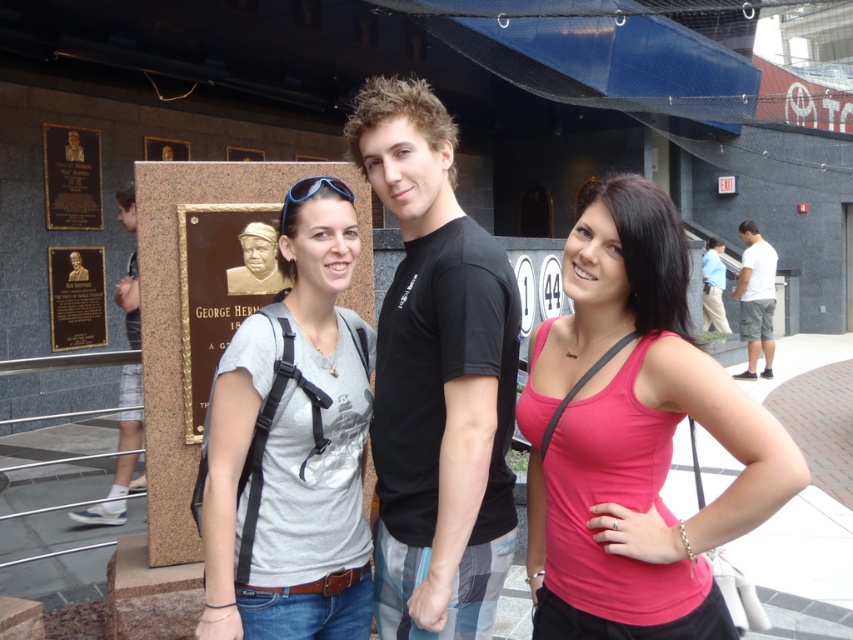
Which is more to the left, black cotton t-shirt at center or gold plated statue at center?

gold plated statue at center

Is black cotton t-shirt at center below gold plated statue at center?

Correct, black cotton t-shirt at center is located below gold plated statue at center.

Is point (404, 320) more distant than point (271, 266)?

No, it is in front of (271, 266).

Find the location of a particular element. black cotton t-shirt at center is located at coordinates (436, 378).

Is matte gray t-shirt at center thinner than matte black statue at left?

Yes, matte gray t-shirt at center is thinner than matte black statue at left.

Does point (352, 436) lie behind point (141, 424)?

That is False.

I want to click on matte gray t-shirt at center, so click(x=294, y=445).

In the scene shown: Is matte bronze statue at center closer to the viewer compared to blue shirt at right?

Yes, matte bronze statue at center is in front of blue shirt at right.

What are the coordinates of `matte bronze statue at center` in the screenshot? It's located at (634, 436).

What do you see at coordinates (634, 436) in the screenshot? I see `matte bronze statue at center` at bounding box center [634, 436].

Where is `matte bronze statue at center`? matte bronze statue at center is located at coordinates (634, 436).